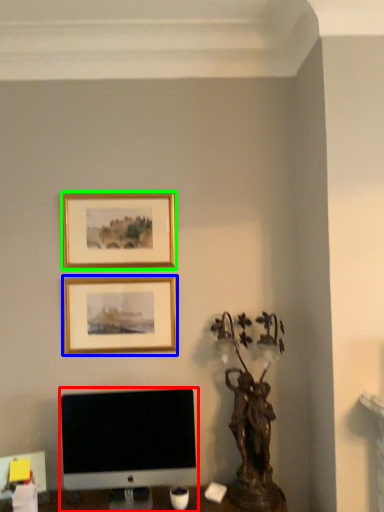
Question: Which object is the farthest from computer monitor (highlighted by a red box)? Choose among these: picture frame (highlighted by a blue box) or picture frame (highlighted by a green box).

Choices:
 (A) picture frame
 (B) picture frame

Answer: (B)